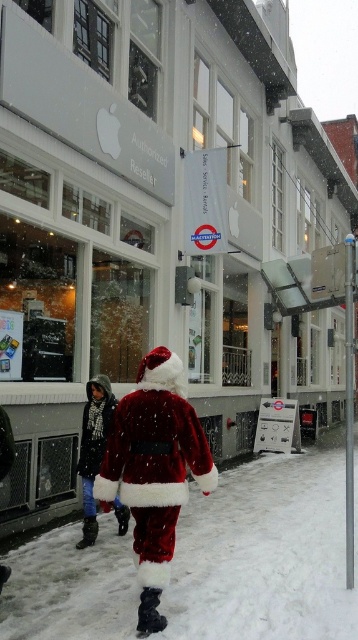
Question: Among these points, which one is nearest to the camera?

Choices:
 (A) (162, 483)
 (B) (308, 552)

Answer: (A)

Question: Is white snow at lower center to the right of velvet santa suit at center from the viewer's perspective?

Choices:
 (A) yes
 (B) no

Answer: (B)

Question: Estimate the real-world distances between objects in this image. Which object is closer to the white snow at lower center?

Choices:
 (A) velvet santa suit at center
 (B) velvet red santa claus at center

Answer: (A)

Question: Which of the following is the closest to the observer?

Choices:
 (A) (321, 452)
 (B) (84, 461)

Answer: (B)

Question: In this image, where is white snow at lower center located relative to velvet santa suit at center?

Choices:
 (A) left
 (B) right

Answer: (A)

Question: Is white snow at lower center to the left of velvet santa suit at center from the viewer's perspective?

Choices:
 (A) yes
 (B) no

Answer: (A)